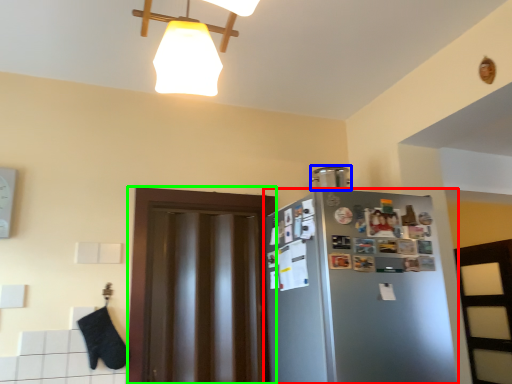
Question: Estimate the real-world distances between objects in this image. Which object is closer to refrigerator (highlighted by a red box), appliance (highlighted by a blue box) or glass door (highlighted by a green box)?

Choices:
 (A) appliance
 (B) glass door

Answer: (B)